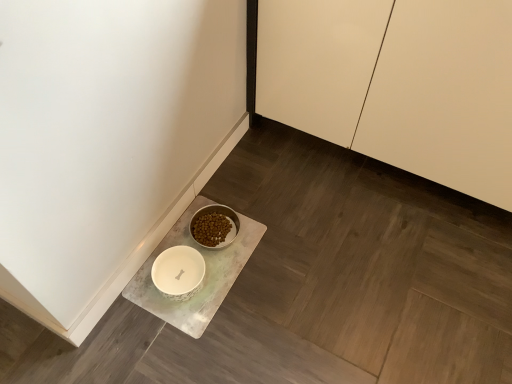
Identify the location of free point in front of white marble tray at lower left. The height and width of the screenshot is (384, 512). (203, 342).